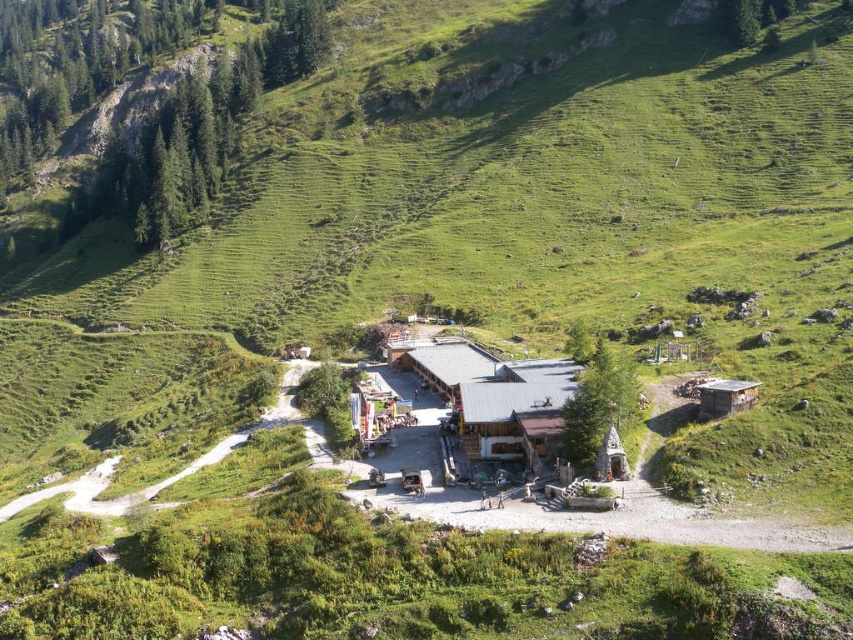
Which of these two, wooden cabin at center or brown wooden hut at center, stands shorter?

Standing shorter between the two is brown wooden hut at center.

Can you confirm if wooden cabin at center is thinner than brown wooden hut at center?

Incorrect, wooden cabin at center's width is not less than brown wooden hut at center's.

Is point (561, 368) in front of point (459, 340)?

Yes.

Where is `wooden cabin at center`? This screenshot has height=640, width=853. wooden cabin at center is located at coordinates (515, 410).

Consider the image. Does brown wooden hut at center have a lesser height compared to wooden cabin at right?

Incorrect, brown wooden hut at center's height does not fall short of wooden cabin at right's.

Identify the location of brown wooden hut at center. (448, 365).

Does point (523, 394) come in front of point (703, 384)?

Yes, it is.

Does wooden cabin at center come behind wooden cabin at right?

That is False.

What do you see at coordinates (515, 410) in the screenshot? I see `wooden cabin at center` at bounding box center [515, 410].

At what (x,y) coordinates should I click in order to perform the action: click on wooden cabin at center. Please return your answer as a coordinate pair (x, y). This screenshot has height=640, width=853. Looking at the image, I should click on (515, 410).